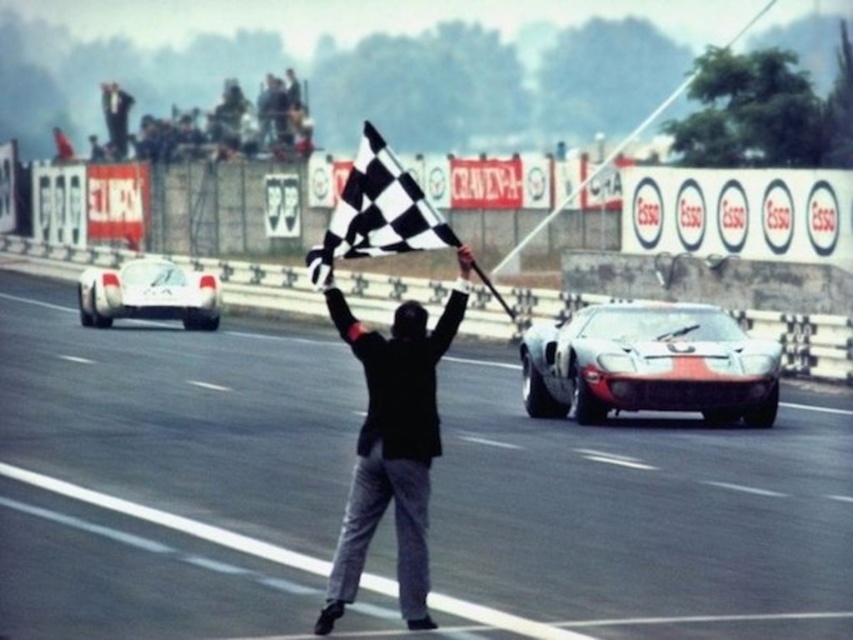
Question: Which of these objects is positioned farthest from the smooth asphalt road at center?

Choices:
 (A) silver metallic sports car at center
 (B) white matte sports car at left
 (C) black checkered flag at center
 (D) black fabric at center

Answer: (B)

Question: Observing the image, what is the correct spatial positioning of silver metallic sports car at center in reference to white matte sports car at left?

Choices:
 (A) right
 (B) left

Answer: (A)

Question: Is black fabric at center smaller than white matte sports car at left?

Choices:
 (A) yes
 (B) no

Answer: (A)

Question: Which point appears closest to the camera in this image?

Choices:
 (A) (700, 595)
 (B) (374, 154)
 (C) (419, 352)
 (D) (106, 316)

Answer: (C)

Question: Does smooth asphalt road at center appear on the left side of silver metallic sports car at center?

Choices:
 (A) yes
 (B) no

Answer: (A)

Question: Among these objects, which one is farthest from the camera?

Choices:
 (A) black checkered flag at center
 (B) silver metallic sports car at center

Answer: (B)